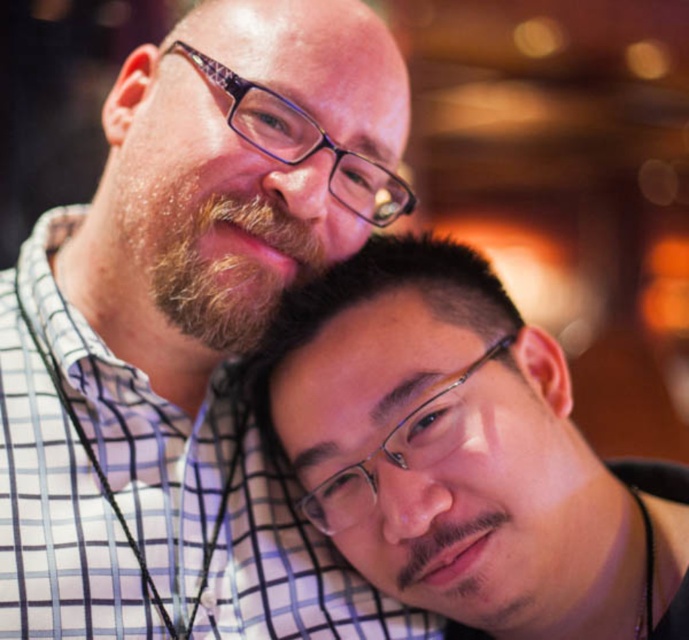
Question: From the image, what is the correct spatial relationship of matte black glasses at lower right in relation to brown fuzzy beard at upper left?

Choices:
 (A) below
 (B) above

Answer: (A)

Question: Among these points, which one is nearest to the camera?

Choices:
 (A) (278, 369)
 (B) (276, 481)

Answer: (A)

Question: Does matte black glasses at lower right have a larger size compared to brown fuzzy beard at upper left?

Choices:
 (A) yes
 (B) no

Answer: (A)

Question: Which object appears closest to the camera in this image?

Choices:
 (A) matte black shirt at upper left
 (B) brown fuzzy beard at upper left
 (C) matte black glasses at lower right

Answer: (C)

Question: Which is nearer to the matte black shirt at upper left?

Choices:
 (A) matte black glasses at lower right
 (B) brown fuzzy beard at upper left

Answer: (B)

Question: Can you confirm if matte black shirt at upper left is positioned to the left of brown fuzzy beard at upper left?

Choices:
 (A) yes
 (B) no

Answer: (B)